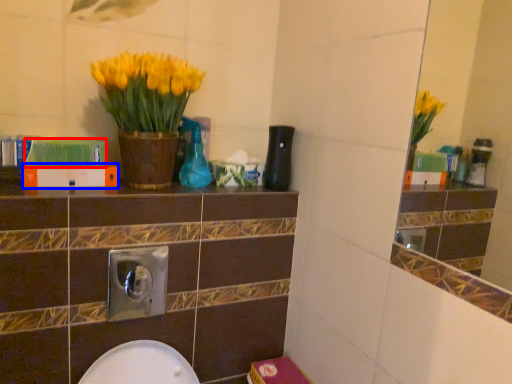
Question: Among these objects, which one is farthest to the camera, book (highlighted by a red box) or book (highlighted by a blue box)?

Choices:
 (A) book
 (B) book

Answer: (B)